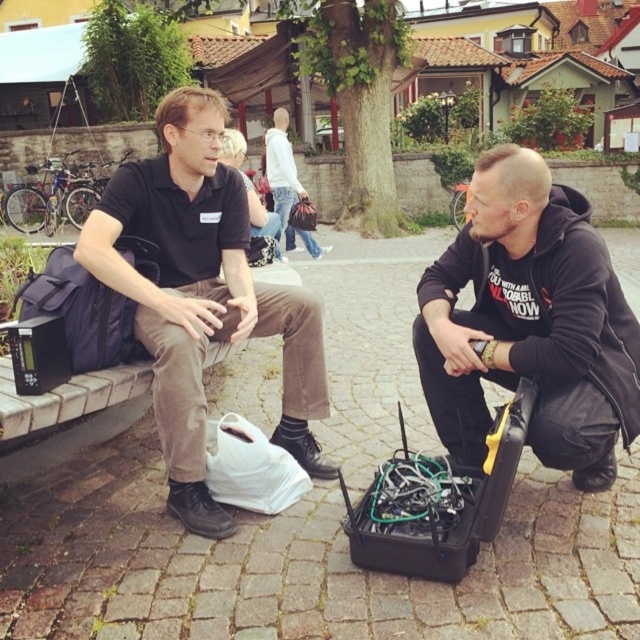
Question: Considering the relative positions of black hoodie at center and black cotton shirt at left in the image provided, where is black hoodie at center located with respect to black cotton shirt at left?

Choices:
 (A) left
 (B) right

Answer: (B)

Question: Can you confirm if black hoodie at center is positioned below black cotton shirt at left?

Choices:
 (A) yes
 (B) no

Answer: (A)

Question: Which object appears farthest from the camera in this image?

Choices:
 (A) black hoodie at center
 (B) black cotton shirt at left

Answer: (B)

Question: Among these points, which one is farthest from the camera?

Choices:
 (A) (492, 228)
 (B) (260, 298)

Answer: (B)

Question: Is black hoodie at center behind black cotton shirt at left?

Choices:
 (A) yes
 (B) no

Answer: (B)